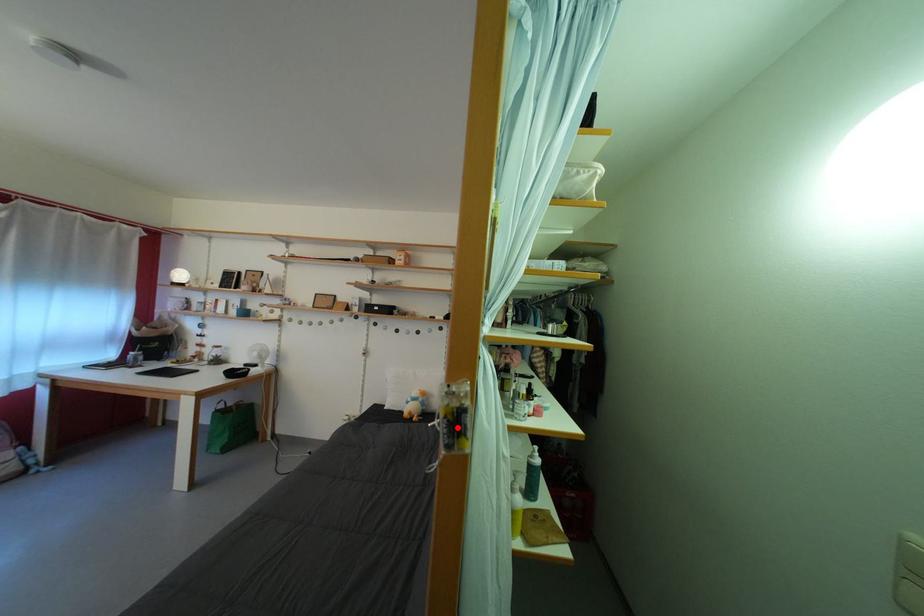
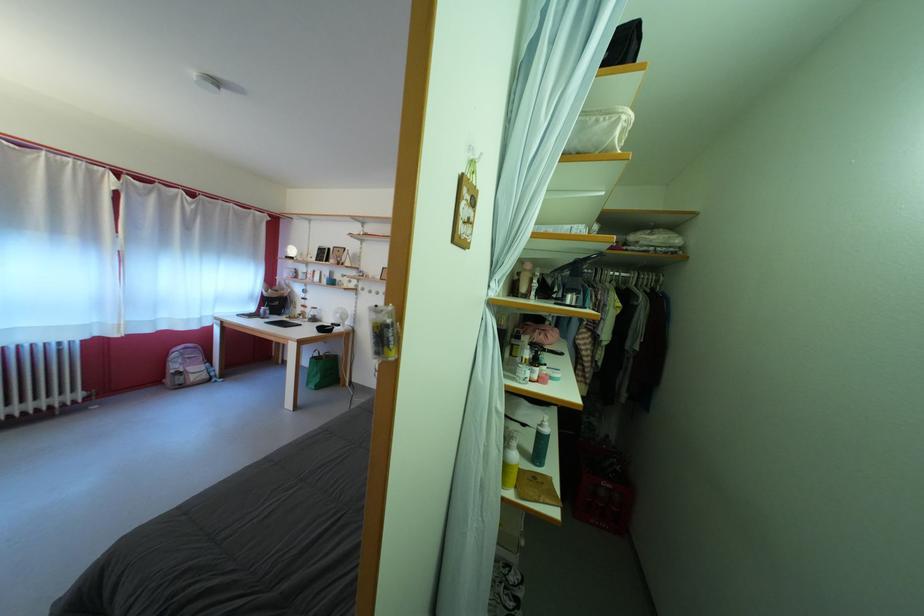
Where in the second image is the point corresponding to the highlighted location from the first image?

(383, 339)